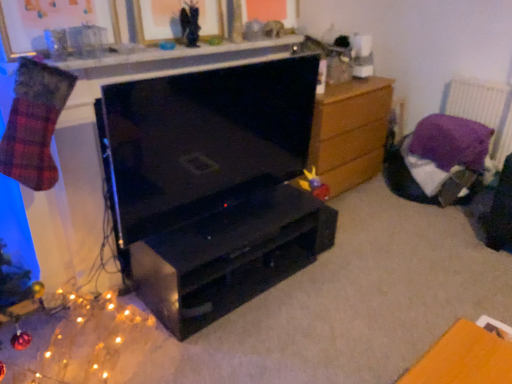
Question: Is metallic gold picture frame at upper center, which is counted as the first picture frame, starting from the right, oriented towards wooden chest of drawers at right?

Choices:
 (A) no
 (B) yes

Answer: (A)

Question: From the image's perspective, is metallic gold picture frame at upper center, the second picture frame positioned from the left, above wooden chest of drawers at right?

Choices:
 (A) no
 (B) yes

Answer: (B)

Question: From a real-world perspective, is metallic gold picture frame at upper center, the second picture frame positioned from the left, positioned over wooden chest of drawers at right based on gravity?

Choices:
 (A) no
 (B) yes

Answer: (B)

Question: Is metallic gold picture frame at upper center, the second picture frame positioned from the left, shorter than wooden chest of drawers at right?

Choices:
 (A) no
 (B) yes

Answer: (B)

Question: Is metallic gold picture frame at upper center, the second picture frame positioned from the left, next to wooden chest of drawers at right?

Choices:
 (A) yes
 (B) no

Answer: (B)

Question: In terms of height, does black matte desk at center look taller or shorter compared to black glossy tv at center?

Choices:
 (A) tall
 (B) short

Answer: (B)

Question: Looking at their shapes, would you say black matte desk at center is wider or thinner than black glossy tv at center?

Choices:
 (A) wide
 (B) thin

Answer: (A)

Question: Choose the correct answer: Is black matte desk at center inside black glossy tv at center or outside it?

Choices:
 (A) inside
 (B) outside

Answer: (B)

Question: Considering their positions, is black matte desk at center located in front of or behind black glossy tv at center?

Choices:
 (A) front
 (B) behind

Answer: (B)

Question: Does point (x=141, y=292) appear closer or farther from the camera than point (x=495, y=158)?

Choices:
 (A) farther
 (B) closer

Answer: (B)

Question: From a real-world perspective, is black matte desk at center positioned above or below purple fabric at upper right?

Choices:
 (A) above
 (B) below

Answer: (B)

Question: From the image's perspective, is black matte desk at center located above or below purple fabric at upper right?

Choices:
 (A) above
 (B) below

Answer: (B)

Question: Do you think black matte desk at center is within purple fabric at upper right, or outside of it?

Choices:
 (A) outside
 (B) inside

Answer: (A)

Question: Do you think black matte desk at center is within smooth white counter at upper center, or outside of it?

Choices:
 (A) outside
 (B) inside

Answer: (A)

Question: Relative to smooth white counter at upper center, is black matte desk at center in front or behind?

Choices:
 (A) front
 (B) behind

Answer: (B)